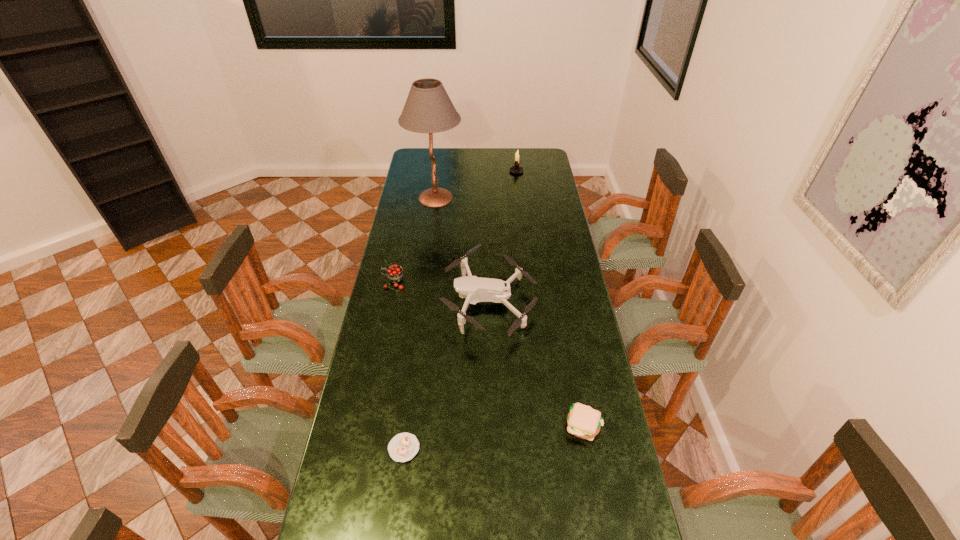
Find the location of a particular element. The image size is (960, 540). free space located with a camera at the front of the drone is located at coordinates (421, 301).

This screenshot has height=540, width=960. I want to click on vacant space located with a camera at the front of the drone, so click(x=390, y=301).

Locate an element on the screen. free location located 0.260m with a camera at the front of the drone is located at coordinates (374, 301).

Image resolution: width=960 pixels, height=540 pixels. I want to click on vacant position located on the front of the fifth tallest object, so click(x=594, y=485).

I want to click on vacant space located on the right of the shortest object, so click(531, 448).

Where is `object positioned at the far edge`? The width and height of the screenshot is (960, 540). object positioned at the far edge is located at coordinates (516, 169).

Find the location of a particular element. This screenshot has width=960, height=540. table lamp located at the left edge is located at coordinates [428, 109].

At what (x,y) coordinates should I click in order to perform the action: click on cherry situated at the left edge. Please return your answer as a coordinate pair (x, y). The height and width of the screenshot is (540, 960). Looking at the image, I should click on click(x=395, y=274).

The height and width of the screenshot is (540, 960). In order to click on cupcake present at the left edge in this screenshot , I will do `click(403, 447)`.

Image resolution: width=960 pixels, height=540 pixels. I want to click on candle holder that is positioned at the right edge, so click(516, 169).